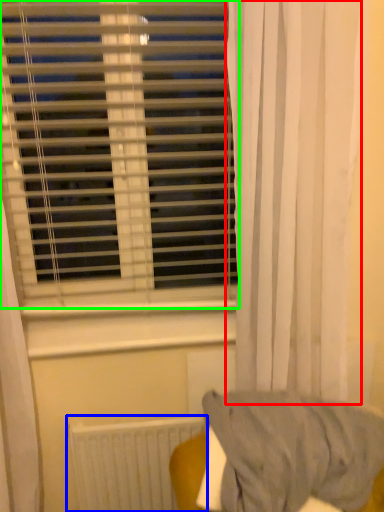
Question: Which is farther away from curtain (highlighted by a red box)? radiator (highlighted by a blue box) or window blind (highlighted by a green box)?

Choices:
 (A) radiator
 (B) window blind

Answer: (A)